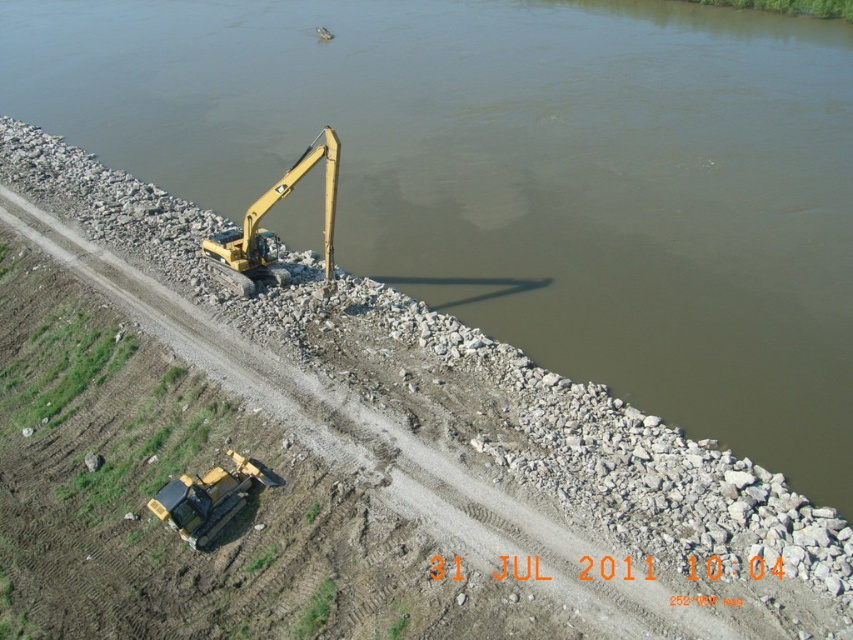
Question: Can you confirm if yellow metallic excavator at center is positioned to the left of yellow rubber tractor at lower left?

Choices:
 (A) yes
 (B) no

Answer: (A)

Question: Is yellow metallic excavator at center thinner than yellow rubber tractor at lower left?

Choices:
 (A) yes
 (B) no

Answer: (B)

Question: Among these objects, which one is nearest to the camera?

Choices:
 (A) yellow metallic excavator at center
 (B) yellow rubber tractor at lower left

Answer: (B)

Question: Does yellow metallic excavator at center come in front of yellow rubber tractor at lower left?

Choices:
 (A) no
 (B) yes

Answer: (A)

Question: Which of the following is the farthest from the observer?

Choices:
 (A) yellow rubber tractor at lower left
 (B) yellow metallic excavator at center

Answer: (B)

Question: Which point is closer to the camera?

Choices:
 (A) yellow metallic excavator at center
 (B) yellow rubber tractor at lower left

Answer: (B)